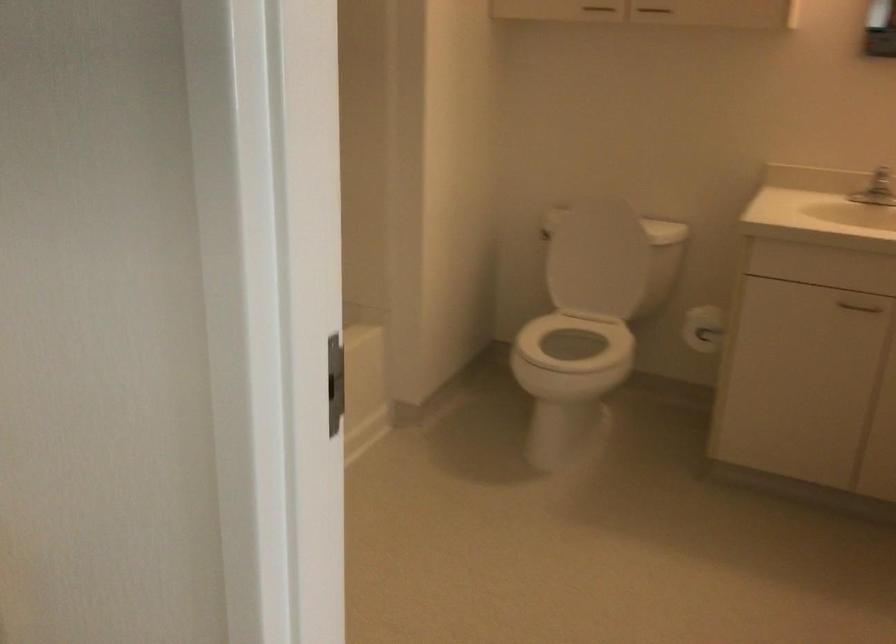
Identify the location of white toilet seat. (571, 357).